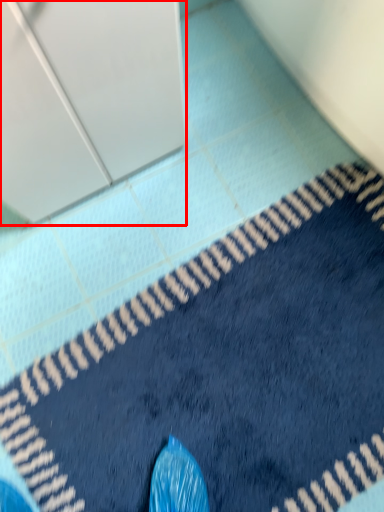
Question: From the image, what is the correct spatial relationship of screen door (annotated by the red box) in relation to bath mat?

Choices:
 (A) right
 (B) left

Answer: (B)